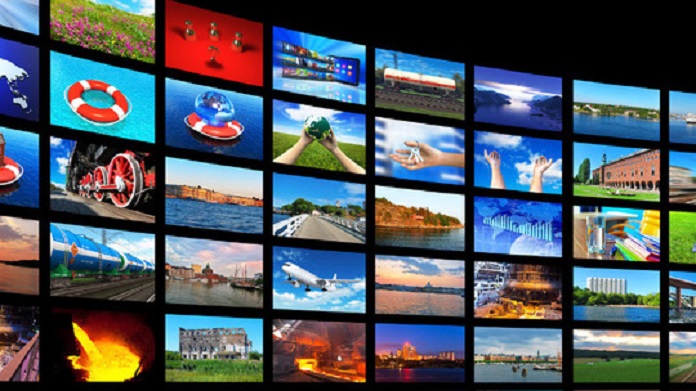
Where is `2nd row of pictures from the top`? The width and height of the screenshot is (696, 391). 2nd row of pictures from the top is located at coordinates (13, 74), (97, 103), (200, 108), (322, 134), (422, 143), (514, 159), (594, 165), (679, 175).